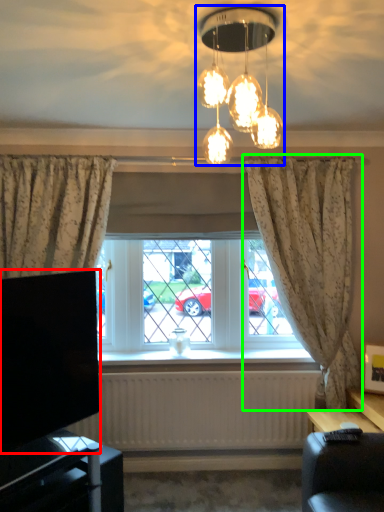
Question: Based on their relative distances, which object is farther from television (highlighted by a red box)? Choose from lamp (highlighted by a blue box) and curtain (highlighted by a green box).

Choices:
 (A) lamp
 (B) curtain

Answer: (B)